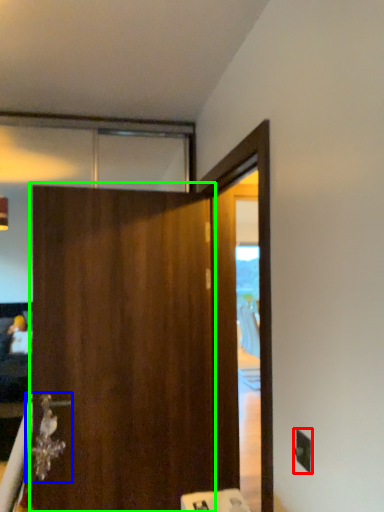
Question: Based on their relative distances, which object is nearer to electric outlet (highlighted by a red box)? Choose from door handle (highlighted by a blue box) and barn door (highlighted by a green box).

Choices:
 (A) door handle
 (B) barn door

Answer: (B)